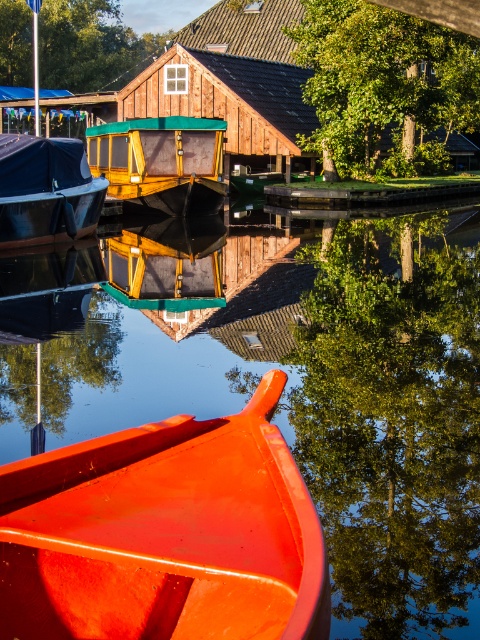
Question: Which point is closer to the camera?

Choices:
 (A) (452, 316)
 (B) (322, 35)

Answer: (A)

Question: Considering the real-world distances, which object is farthest from the wooden cabin cruiser at center?

Choices:
 (A) matte black tarpaulin at left
 (B) green leafy tree at upper left
 (C) glossy orange canoe at lower center
 (D) glossy wooden boat at lower left

Answer: (B)

Question: Can you confirm if glossy wooden boat at lower left is bigger than green leafy tree at upper left?

Choices:
 (A) no
 (B) yes

Answer: (A)

Question: From the image, what is the correct spatial relationship of glossy wooden boat at lower left in relation to wooden cabin cruiser at center?

Choices:
 (A) right
 (B) left

Answer: (A)

Question: Is glossy orange canoe at lower center bigger than green leafy tree at upper left?

Choices:
 (A) no
 (B) yes

Answer: (A)

Question: Which object is positioned closest to the wooden cabin cruiser at center?

Choices:
 (A) glossy wooden boat at lower left
 (B) glossy orange canoe at lower center
 (C) green leafy tree at lower center
 (D) matte black tarpaulin at left

Answer: (D)